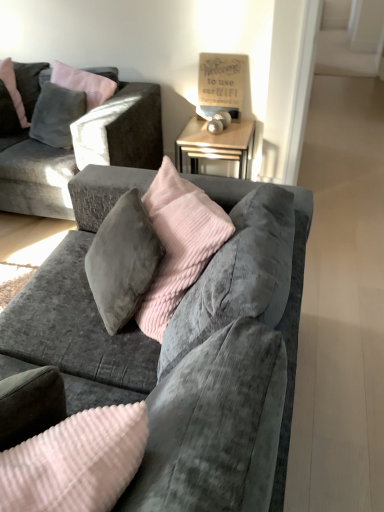
Question: Can you confirm if velvet gray couch at center, placed as the first studio couch when sorted from bottom to top, is thinner than matte gray pillow at upper left?

Choices:
 (A) no
 (B) yes

Answer: (A)

Question: From a real-world perspective, does velvet gray couch at center, placed as the first studio couch when sorted from bottom to top, stand above matte gray pillow at upper left?

Choices:
 (A) no
 (B) yes

Answer: (A)

Question: Is velvet gray couch at center, which is counted as the second studio couch, starting from the back, far from matte gray pillow at upper left?

Choices:
 (A) no
 (B) yes

Answer: (B)

Question: Does velvet gray couch at center, which appears as the first studio couch when viewed from the front, have a greater height compared to matte gray pillow at upper left?

Choices:
 (A) yes
 (B) no

Answer: (A)

Question: From a real-world perspective, is velvet gray couch at center, the 2th studio couch from the top, beneath matte gray pillow at upper left?

Choices:
 (A) yes
 (B) no

Answer: (A)

Question: Considering the positions of velvet gray couch at center, the 2th studio couch from the top, and matte gray pillow at upper left in the image, is velvet gray couch at center, the 2th studio couch from the top, wider or thinner than matte gray pillow at upper left?

Choices:
 (A) thin
 (B) wide

Answer: (B)

Question: Considering the positions of velvet gray couch at center, the 2th studio couch from the top, and matte gray pillow at upper left in the image, is velvet gray couch at center, the 2th studio couch from the top, taller or shorter than matte gray pillow at upper left?

Choices:
 (A) tall
 (B) short

Answer: (A)

Question: In the image, is velvet gray couch at center, which is counted as the second studio couch, starting from the back, on the left side or the right side of matte gray pillow at upper left?

Choices:
 (A) right
 (B) left

Answer: (A)

Question: Do you think velvet gray couch at center, which is counted as the second studio couch, starting from the back, is within matte gray pillow at upper left, or outside of it?

Choices:
 (A) inside
 (B) outside

Answer: (B)

Question: In terms of width, does matte gray pillow at upper left look wider or thinner when compared to velvet gray couch at upper left, which ranks as the second studio couch in front-to-back order?

Choices:
 (A) thin
 (B) wide

Answer: (A)

Question: From a real-world perspective, is matte gray pillow at upper left physically located above or below velvet gray couch at upper left, the 1th studio couch from the top?

Choices:
 (A) below
 (B) above

Answer: (B)

Question: From the image's perspective, is matte gray pillow at upper left above or below velvet gray couch at upper left, the 1th studio couch from the top?

Choices:
 (A) above
 (B) below

Answer: (A)

Question: Would you say matte gray pillow at upper left is inside or outside velvet gray couch at upper left, which ranks as the second studio couch in front-to-back order?

Choices:
 (A) inside
 (B) outside

Answer: (A)

Question: Looking at their shapes, would you say matte gray pillow at upper left is wider or thinner than velvet gray couch at center, which appears as the first studio couch when viewed from the front?

Choices:
 (A) wide
 (B) thin

Answer: (B)

Question: From the image's perspective, is matte gray pillow at upper left positioned above or below velvet gray couch at center, which appears as the first studio couch when viewed from the front?

Choices:
 (A) below
 (B) above

Answer: (B)